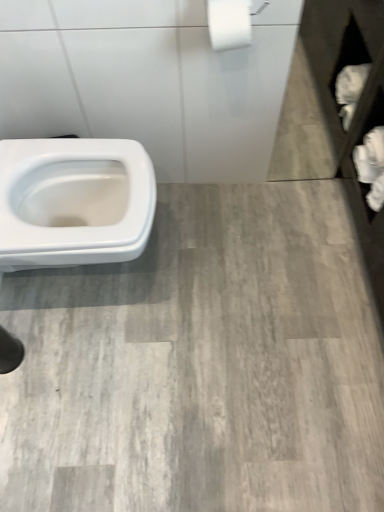
Question: Does point (374, 133) appear closer or farther from the camera than point (233, 0)?

Choices:
 (A) farther
 (B) closer

Answer: (A)

Question: Is white matte toilet paper at right, placed as the 2th toilet paper when sorted from front to back, inside the boundaries of white matte toilet paper at upper right, positioned as the first toilet paper in top-to-bottom order, or outside?

Choices:
 (A) outside
 (B) inside

Answer: (A)

Question: Based on their positions, is white matte toilet paper at right, the 1th toilet paper when ordered from right to left, located to the left or right of white matte toilet paper at upper right, positioned as the first toilet paper in top-to-bottom order?

Choices:
 (A) left
 (B) right

Answer: (B)

Question: Is white matte toilet paper at upper right, the second toilet paper viewed from the right, to the left or to the right of white matte toilet paper at right, placed as the first toilet paper when sorted from bottom to top, in the image?

Choices:
 (A) left
 (B) right

Answer: (A)

Question: Do you think white matte toilet paper at upper right, positioned as the first toilet paper in top-to-bottom order, is within white matte toilet paper at right, placed as the first toilet paper when sorted from bottom to top, or outside of it?

Choices:
 (A) outside
 (B) inside

Answer: (A)

Question: Is white matte toilet paper at upper right, placed as the first toilet paper when sorted from front to back, taller or shorter than white matte toilet paper at right, the 1th toilet paper when ordered from right to left?

Choices:
 (A) tall
 (B) short

Answer: (B)

Question: In the image, is white matte toilet paper at upper right, placed as the first toilet paper when sorted from front to back, positioned in front of or behind white matte toilet paper at right, the 1th toilet paper from the back?

Choices:
 (A) behind
 (B) front

Answer: (B)